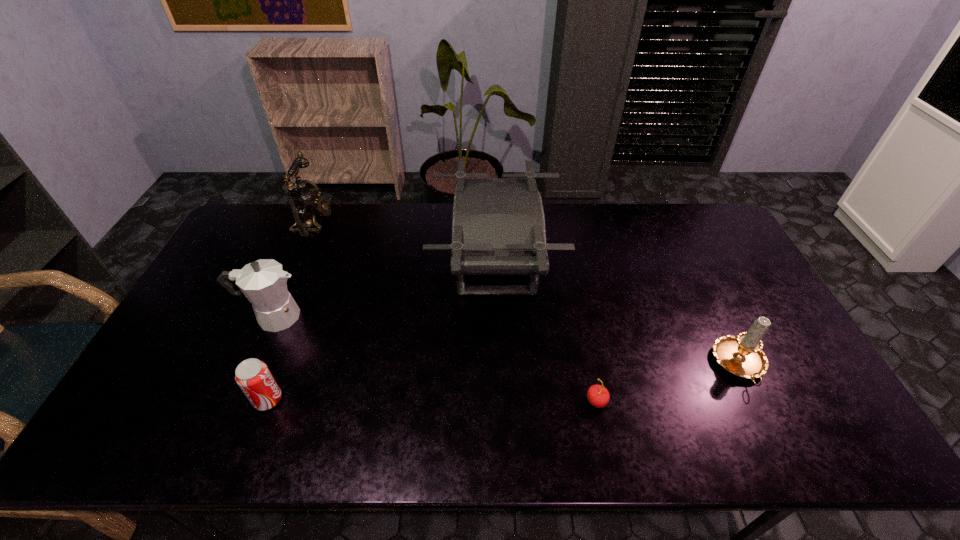
Image resolution: width=960 pixels, height=540 pixels. In order to click on free space at the far edge in this screenshot , I will do `click(433, 236)`.

You are a GUI agent. You are given a task and a screenshot of the screen. Output one action in this format:
    pyautogui.click(x=<x>, y=<y>)
    Task: Click on the free region at the near edge of the desktop
    The height and width of the screenshot is (540, 960).
    Given the screenshot: What is the action you would take?
    pyautogui.click(x=468, y=435)

The height and width of the screenshot is (540, 960). In the image, there is a desktop. What are the coordinates of `free region at the left edge` in the screenshot? It's located at (180, 346).

This screenshot has height=540, width=960. I want to click on free space at the right edge, so click(x=777, y=417).

In the image, there is a desktop. At what (x,y) coordinates should I click in order to perform the action: click on vacant region at the far left corner. Please return your answer as a coordinate pair (x, y). The image size is (960, 540). Looking at the image, I should click on (268, 216).

Where is `empty location between the shortest object and the fourth tallest object`? This screenshot has width=960, height=540. empty location between the shortest object and the fourth tallest object is located at coordinates (668, 383).

This screenshot has height=540, width=960. I want to click on empty space between the fifth object from left to right and the telephone, so click(x=455, y=312).

The height and width of the screenshot is (540, 960). Find the location of `free spot between the coffeepot and the soda can`. free spot between the coffeepot and the soda can is located at coordinates (271, 358).

At what (x,y) coordinates should I click in order to perform the action: click on free space that is in between the fourth object from left to right and the candle. Please return your answer as a coordinate pair (x, y). Looking at the image, I should click on (617, 314).

Image resolution: width=960 pixels, height=540 pixels. Find the location of `vacant area that lies between the second shortest object and the third shortest object`. vacant area that lies between the second shortest object and the third shortest object is located at coordinates (504, 382).